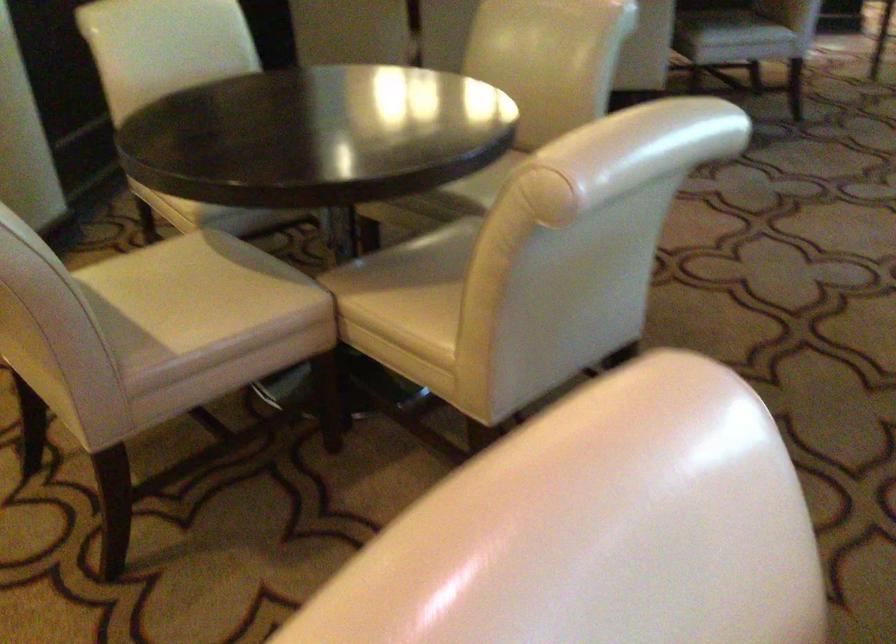
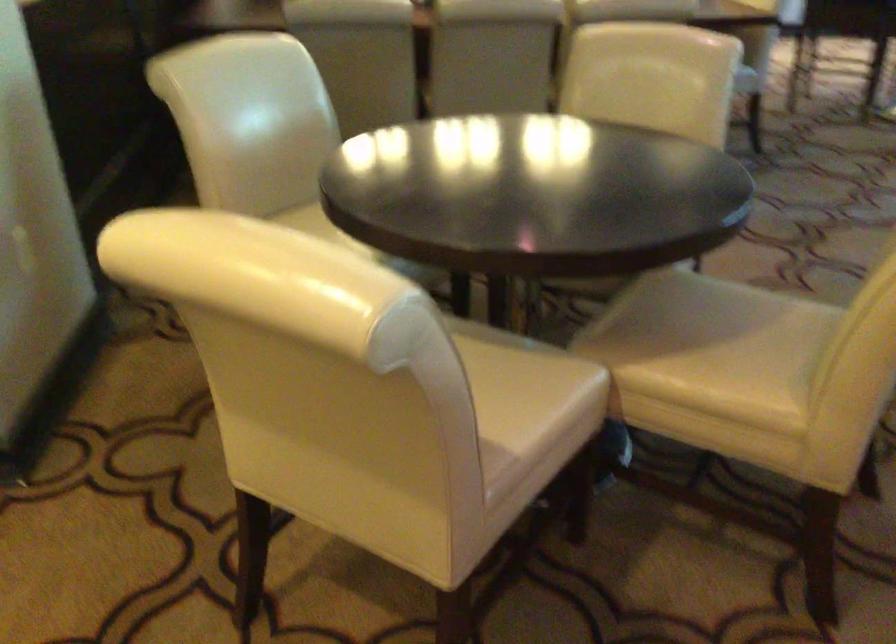
Find the pixel in the second image that matches (x=247, y=294) in the first image.

(530, 377)